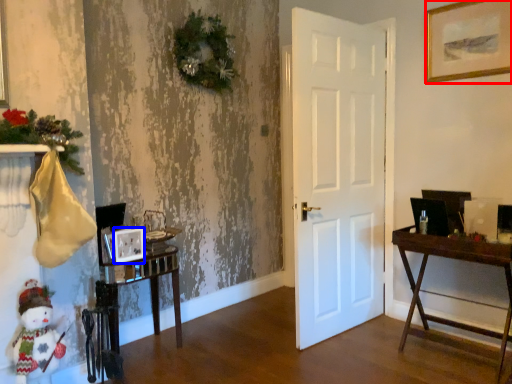
Question: Which object appears closest to the camera in this image, picture frame (highlighted by a red box) or picture frame (highlighted by a blue box)?

Choices:
 (A) picture frame
 (B) picture frame

Answer: (B)